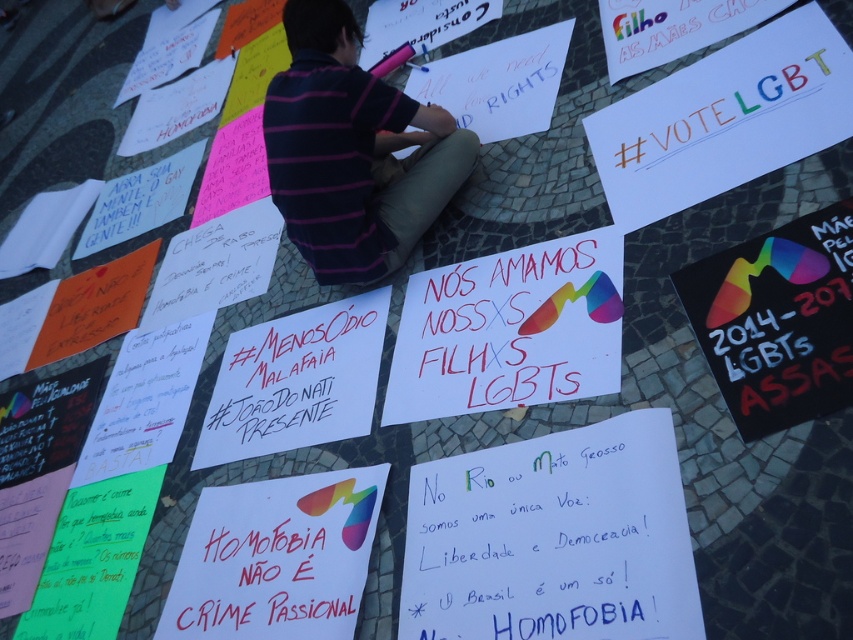
You are a photographer at the protest, and you want to capture both the striped cotton shirt at center and the matte white sign at center in a single frame. Which object should you position to the left to ensure both are visible?

The striped cotton shirt at center is positioned on the right side of the matte white sign at center, so you should position the matte white sign at center to the left side of the striped cotton shirt at center to ensure both are visible in the frame.

You are a photographer at the protest and want to capture both the striped cotton shirt at center and the matte white sign at center in a single frame. Considering their sizes, which object should you focus on to ensure both are clearly visible?

The striped cotton shirt at center has a larger size compared to matte white sign at center. To ensure both are clearly visible, focus on the striped cotton shirt at center as it is larger and will remain in focus while the smaller matte white sign at center will also be in the frame.

You are attending a protest and want to pick up the striped cotton shirt at center and the matte white sign at center. If you can only carry one item, which one is closer to your current position?

The striped cotton shirt at center is 25.72 inches away from the matte white sign at center. Since both items are at the same central position, they are equally close to your current position.